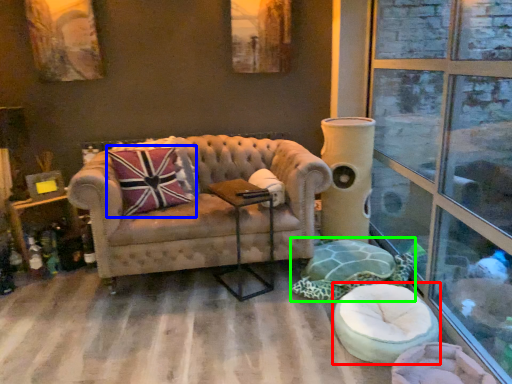
Question: Considering the real-world distances, which object is closest to swivel chair (highlighted by a red box)? throw pillow (highlighted by a blue box) or swivel chair (highlighted by a green box).

Choices:
 (A) throw pillow
 (B) swivel chair

Answer: (B)